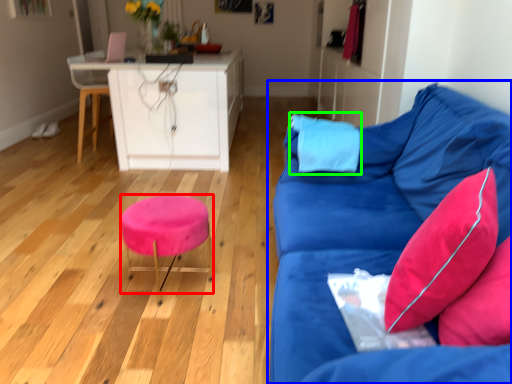
Question: Which object is the farthest from stool (highlighted by a red box)? Choose among these: studio couch (highlighted by a blue box) or pillow (highlighted by a green box).

Choices:
 (A) studio couch
 (B) pillow

Answer: (B)